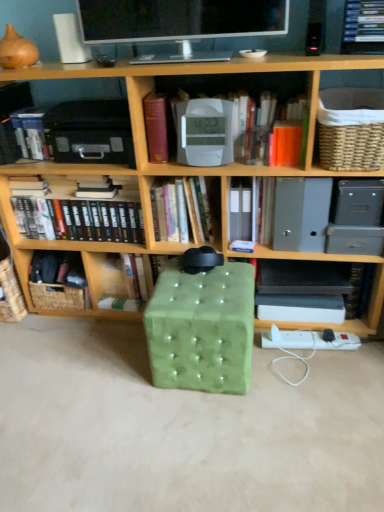
I want to click on vacant area that lies to the right of green velvet ottoman at center, so click(301, 375).